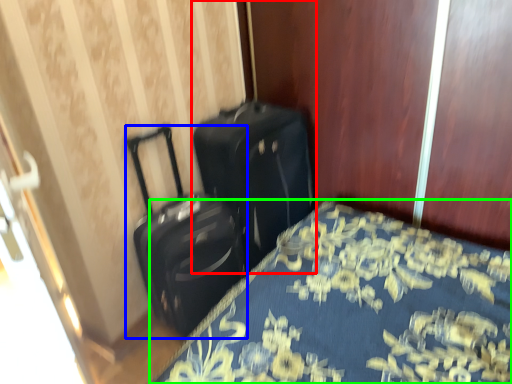
Question: Which is farther away from suitcase (highlighted by a red box)? suitcase (highlighted by a blue box) or bed (highlighted by a green box)?

Choices:
 (A) suitcase
 (B) bed

Answer: (B)